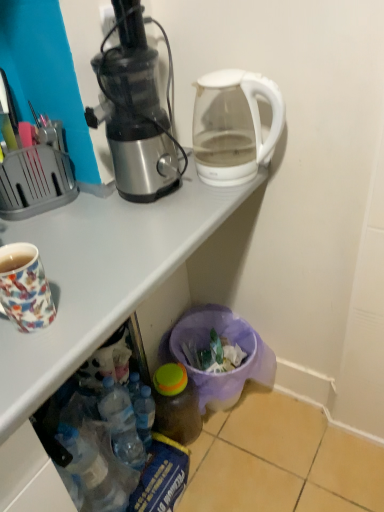
The width and height of the screenshot is (384, 512). In order to click on free space to the left of metallic silver juicer at left in this screenshot , I will do `click(75, 217)`.